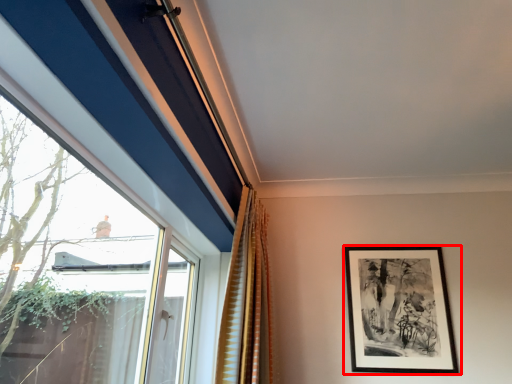
Question: From the image's perspective, where is picture frame (annotated by the red box) located in relation to curtain in the image?

Choices:
 (A) below
 (B) above

Answer: (A)